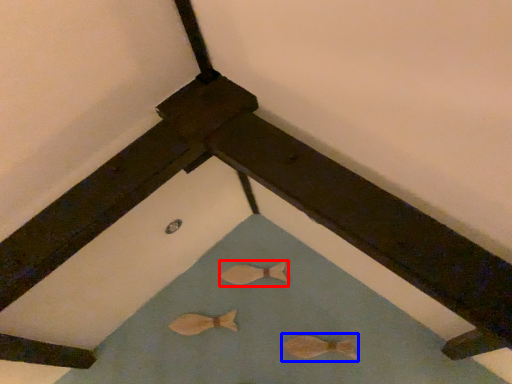
Question: Which object is closer to the camera taking this photo, animal (highlighted by a red box) or animal (highlighted by a blue box)?

Choices:
 (A) animal
 (B) animal

Answer: (B)